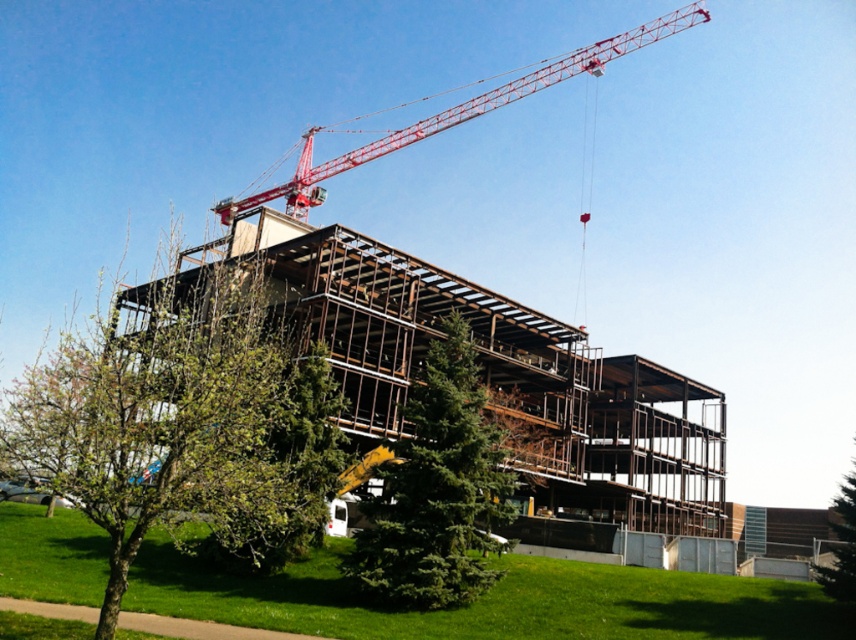
Question: Can you confirm if green leafy tree at center is smaller than green textured tree at lower right?

Choices:
 (A) no
 (B) yes

Answer: (B)

Question: Which object is farther from the camera taking this photo?

Choices:
 (A) red metallic crane at upper center
 (B) green textured tree at lower right

Answer: (A)

Question: Which of these objects is positioned farthest from the green leafy tree at center?

Choices:
 (A) green textured tree at lower right
 (B) green evergreen tree at center
 (C) red metallic crane at upper center

Answer: (C)

Question: Can you confirm if red metallic crane at upper center is thinner than green textured tree at lower right?

Choices:
 (A) yes
 (B) no

Answer: (B)

Question: Is green evergreen tree at center positioned behind red metallic crane at upper center?

Choices:
 (A) yes
 (B) no

Answer: (B)

Question: Which object is the farthest from the green leafy tree at center?

Choices:
 (A) green textured tree at lower right
 (B) green evergreen tree at center
 (C) red metallic crane at upper center

Answer: (C)